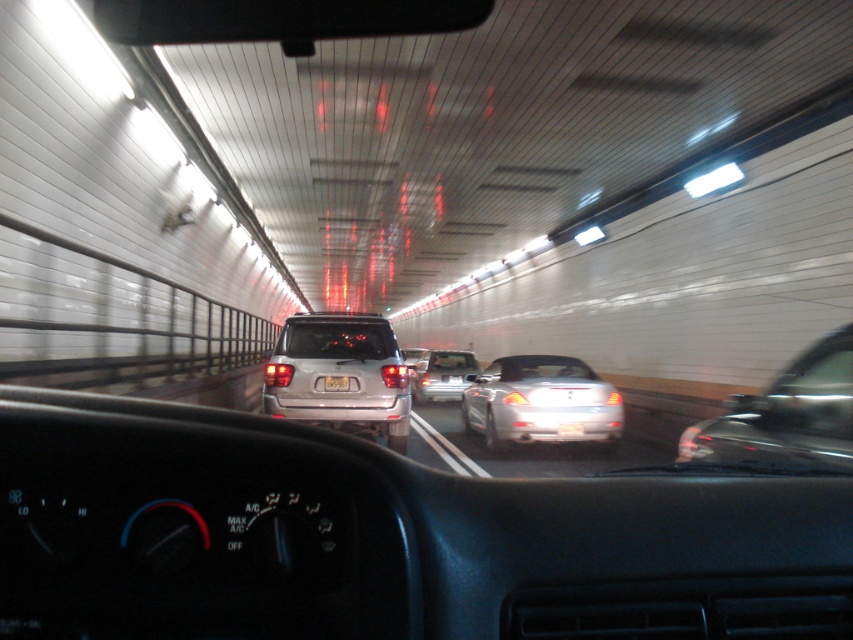
Question: Considering the real-world distances, which object is closest to the satin silver suv at center?

Choices:
 (A) satin silver sedan at center
 (B) white plastic license plate at center
 (C) yellow matte license plate at center

Answer: (B)

Question: Which point is closer to the camera taking this photo?

Choices:
 (A) (479, 419)
 (B) (474, 371)
 (C) (334, 387)
 (D) (827, 376)

Answer: (D)

Question: Does silver metallic sedan at center appear under satin silver sedan at center?

Choices:
 (A) no
 (B) yes

Answer: (A)

Question: Which is farther from the satin silver suv at center?

Choices:
 (A) satin silver sedan at center
 (B) yellow matte license plate at center

Answer: (A)

Question: Observing the image, what is the correct spatial positioning of satin silver suv at center in reference to metallic silver sedan at right?

Choices:
 (A) left
 (B) right

Answer: (A)

Question: Is satin silver sedan at center positioned in front of yellow matte license plate at center?

Choices:
 (A) no
 (B) yes

Answer: (A)